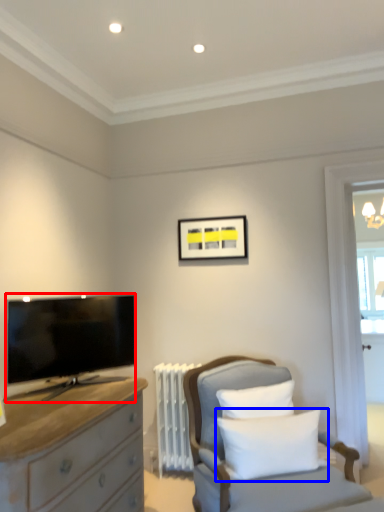
Question: Which object is closer to the camera taking this photo, television (highlighted by a red box) or pillow (highlighted by a blue box)?

Choices:
 (A) television
 (B) pillow

Answer: (B)